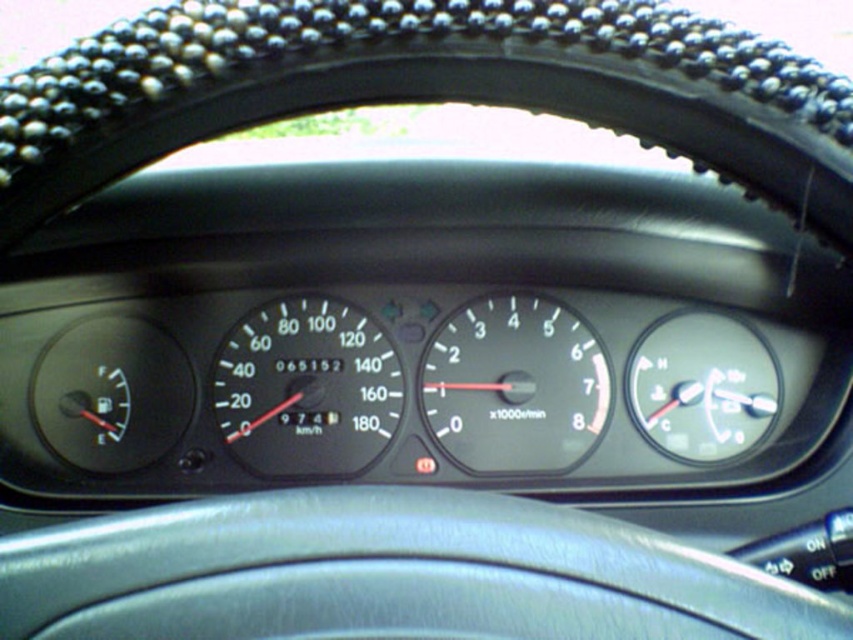
You are driving a car and want to check both the black plastic speedometer at center and the transparent plastic temperature gauge at right. Which instrument do you need to look at first if you want to monitor your current speed?

The black plastic speedometer at center is taller than the transparent plastic temperature gauge at right, so it is more prominent and easier to see, making it the first instrument to look at for monitoring current speed.

You are a mechanic working on a car. You need to replace the black plastic speedometer at center and the transparent plastic temperature gauge at right. The replacement parts are 20 inches wide. Will the new parts fit in the space between them?

The black plastic speedometer at center and transparent plastic temperature gauge at right are 20.88 inches apart. Since the replacement parts are 20 inches wide, they will fit in the space between them because 20 inches is less than 20.88 inches.